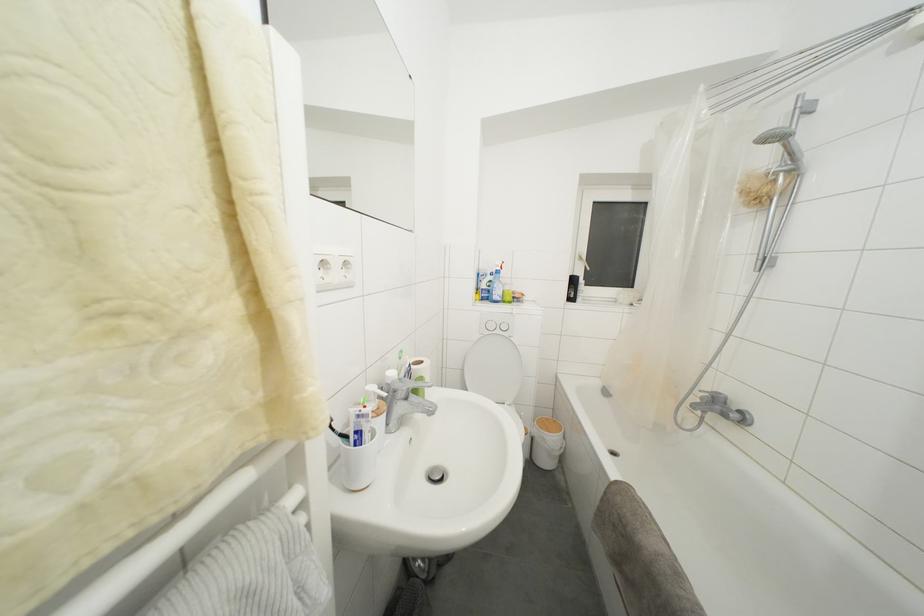
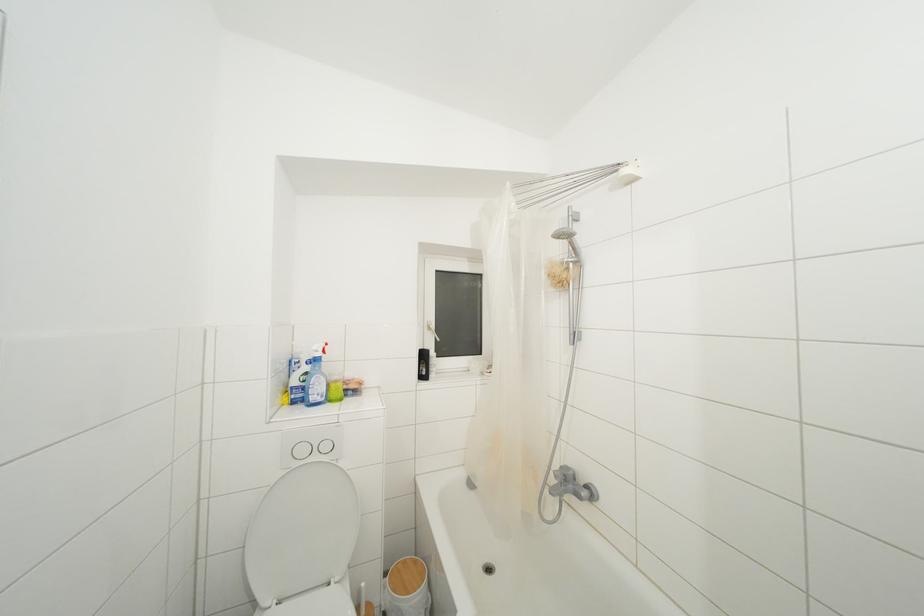
The point at (495, 331) is marked in the first image. Where is the corresponding point in the second image?

(307, 456)